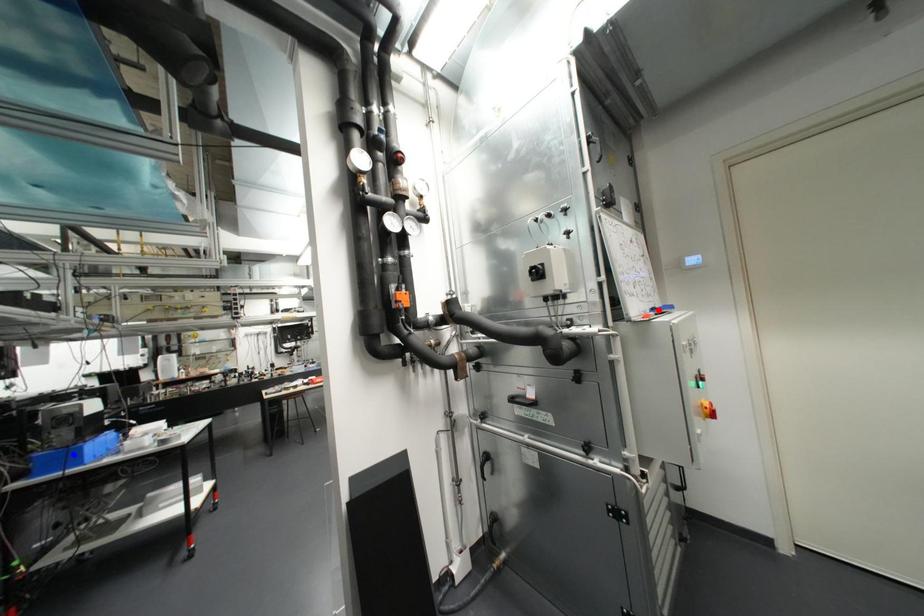
Question: Two points are marked on the image. Which point is closer to the camera?

Choices:
 (A) Blue point is closer.
 (B) Red point is closer.

Answer: (B)